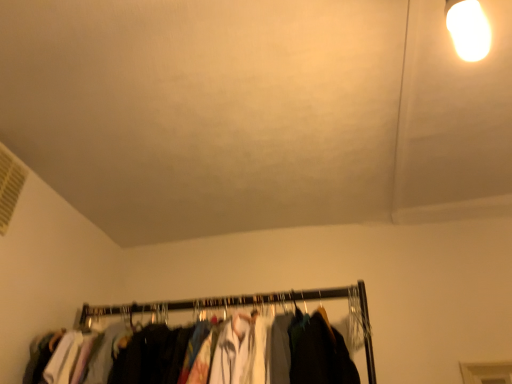
Describe the element at coordinates (9, 185) in the screenshot. I see `white plastic vent at upper left` at that location.

The width and height of the screenshot is (512, 384). I want to click on white plastic vent at upper left, so click(9, 185).

I want to click on white plastic vent at upper left, so click(9, 185).